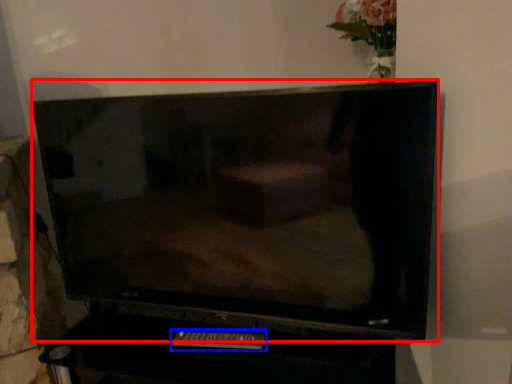
Question: Which point is further to the camera, television (highlighted by a red box) or remote (highlighted by a blue box)?

Choices:
 (A) television
 (B) remote

Answer: (B)